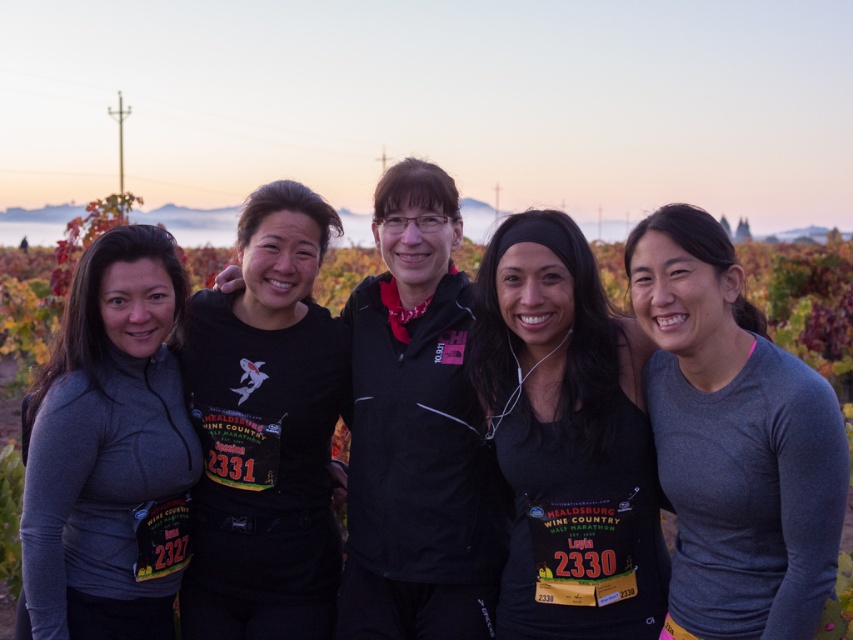
Between black matte jacket at center and matte gray hoodie at left, which one has less height?

matte gray hoodie at left

Which is behind, point (445, 288) or point (79, 413)?

Point (445, 288)

Is point (393, 340) less distant than point (155, 637)?

No, it is not.

The width and height of the screenshot is (853, 640). I want to click on black matte jacket at center, so click(x=416, y=433).

Who is taller, black matte tank top at center or matte gray hoodie at left?

matte gray hoodie at left

Who is positioned more to the right, black matte tank top at center or matte gray hoodie at left?

black matte tank top at center

I want to click on black matte tank top at center, so click(x=567, y=436).

Is the position of black matte tank top at center less distant than that of black matte shirt at center?

Yes.

Where is `black matte tank top at center`? The image size is (853, 640). black matte tank top at center is located at coordinates [x=567, y=436].